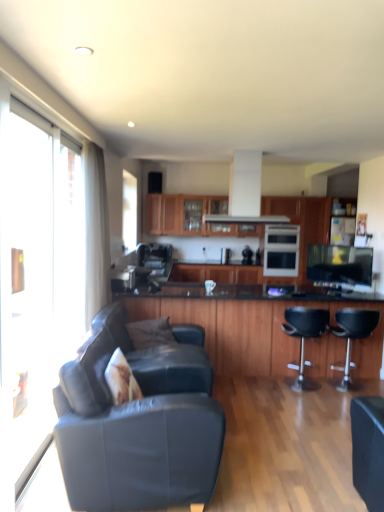
The width and height of the screenshot is (384, 512). What are the coordinates of `black leather bar stool at center right, placed as the 2th chair when sorted from right to left` in the screenshot? It's located at (305, 338).

What is the approximate width of transparent glass window at left?

4.10 inches.

Describe the element at coordinates (95, 231) in the screenshot. I see `white sheer curtain at left` at that location.

Image resolution: width=384 pixels, height=512 pixels. I want to click on transparent glass screen door at left, so click(35, 281).

You are a GUI agent. You are given a task and a screenshot of the screen. Output one action in this format:
    pyautogui.click(x=<x>, y=<y>)
    Task: Click on the black leather bar stool at center right, placed as the 2th chair when sorted from right to left
    The width and height of the screenshot is (384, 512).
    Given the screenshot: What is the action you would take?
    pyautogui.click(x=305, y=338)

Considering the positions of objects wooden cabinet at center, acting as the first cabinetry starting from the back, and black leather bar stool at center right, acting as the first chair starting from the left, in the image provided, who is more to the right, wooden cabinet at center, acting as the first cabinetry starting from the back, or black leather bar stool at center right, acting as the first chair starting from the left,?

black leather bar stool at center right, acting as the first chair starting from the left, is more to the right.

From a real-world perspective, is wooden cabinet at center, which appears as the second cabinetry when viewed from the front, over black leather bar stool at center right, placed as the 2th chair when sorted from right to left?

Yes, from a real-world perspective, wooden cabinet at center, which appears as the second cabinetry when viewed from the front, is above black leather bar stool at center right, placed as the 2th chair when sorted from right to left.

Would you say wooden cabinet at center, which appears as the second cabinetry when viewed from the front, is outside black leather bar stool at center right, placed as the 2th chair when sorted from right to left?

Indeed, wooden cabinet at center, which appears as the second cabinetry when viewed from the front, is completely outside black leather bar stool at center right, placed as the 2th chair when sorted from right to left.

Is wooden cabinet at center, which appears as the second cabinetry when viewed from the front, taller than black leather bar stool at center right, acting as the first chair starting from the left?

No.

From a real-world perspective, is black leather bar stool at center right, placed as the 2th chair when sorted from right to left, positioned over black leather bar stool at center, arranged as the second chair when viewed from the left, based on gravity?

Indeed, from a real-world perspective, black leather bar stool at center right, placed as the 2th chair when sorted from right to left, stands above black leather bar stool at center, arranged as the second chair when viewed from the left.

How many degrees apart are the facing directions of black leather bar stool at center right, acting as the first chair starting from the left, and black leather bar stool at center, arranged as the second chair when viewed from the left?

1.42 degrees.

Between point (302, 352) and point (346, 339), which one is positioned in front?

The point (346, 339) is in front.

From a real-world perspective, is transparent glass screen door at left positioned under wooden cabinet at center, which appears as the second cabinetry when viewed from the front, based on gravity?

Actually, transparent glass screen door at left is physically above wooden cabinet at center, which appears as the second cabinetry when viewed from the front, in the real world.

What's the angular difference between transparent glass screen door at left and wooden cabinet at center, which appears as the second cabinetry when viewed from the front,'s facing directions?

The facing directions of transparent glass screen door at left and wooden cabinet at center, which appears as the second cabinetry when viewed from the front, are 90.6 degrees apart.

From the image's perspective, is transparent glass screen door at left located above or below wooden cabinet at center, acting as the first cabinetry starting from the back?

transparent glass screen door at left is above wooden cabinet at center, acting as the first cabinetry starting from the back.

Consider the image. Which object is more forward, transparent glass screen door at left or wooden cabinet at center, which appears as the second cabinetry when viewed from the front?

transparent glass screen door at left.

Where is `oven above the leather couch at lower left (from the image's perspective)`? oven above the leather couch at lower left (from the image's perspective) is located at coordinates click(281, 250).

Is point (278, 258) farther from viewer compared to point (174, 352)?

Yes, point (278, 258) is behind point (174, 352).

In terms of height, does white glossy oven at center look taller or shorter compared to leather couch at lower left?

Considering their sizes, white glossy oven at center has less height than leather couch at lower left.

Could you measure the distance between leather couch at lower left and black leather bar stool at center right, acting as the first chair starting from the left?

The distance of leather couch at lower left from black leather bar stool at center right, acting as the first chair starting from the left, is 1.89 meters.

Find the location of a particular element. chair that is the 1st one when counting backward from the leather couch at lower left is located at coordinates (305, 338).

Is point (159, 464) closer to camera compared to point (293, 383)?

Yes, it is in front of point (293, 383).

From a real-world perspective, which object stands above the other?

leather couch at lower left is physically above.

Can you confirm if white glossy oven at center is wider than transparent glass window at left?

Yes, white glossy oven at center is wider than transparent glass window at left.

Is there a large distance between white glossy oven at center and transparent glass window at left?

That's right, there is a large distance between white glossy oven at center and transparent glass window at left.

I want to click on oven above the transparent glass window at left (from the image's perspective), so click(281, 250).

Which is more to the right, white glossy oven at center or transparent glass window at left?

white glossy oven at center is more to the right.

Is gray fabric pillow at center, which is the first pillow in back-to-front order, thinner than black leather bar stool at center right, placed as the 2th chair when sorted from right to left?

Yes, gray fabric pillow at center, which is the first pillow in back-to-front order, is thinner than black leather bar stool at center right, placed as the 2th chair when sorted from right to left.

Is black leather bar stool at center right, placed as the 2th chair when sorted from right to left, at the back of gray fabric pillow at center, which is the first pillow in back-to-front order?

gray fabric pillow at center, which is the first pillow in back-to-front order, is not turned away from black leather bar stool at center right, placed as the 2th chair when sorted from right to left.

Is black leather bar stool at center right, placed as the 2th chair when sorted from right to left, located within gray fabric pillow at center, which is the second pillow in front-to-back order?

No, black leather bar stool at center right, placed as the 2th chair when sorted from right to left, is not surrounded by gray fabric pillow at center, which is the second pillow in front-to-back order.

This screenshot has height=512, width=384. I want to click on the 2nd cabinetry behind the black leather bar stool at center right, placed as the 2th chair when sorted from right to left, so click(216, 273).

You are a GUI agent. You are given a task and a screenshot of the screen. Output one action in this format:
    pyautogui.click(x=<x>, y=<y>)
    Task: Click on the chair on the left of the black leather bar stool at center, arranged as the second chair when viewed from the left
    This screenshot has width=384, height=512.
    Given the screenshot: What is the action you would take?
    pyautogui.click(x=305, y=338)

Looking at the image, which one is located further to white sheer curtain at left, wooden cabinet at center, arranged as the second cabinetry when viewed from the back, or transparent glass screen door at left?

The object further to white sheer curtain at left is wooden cabinet at center, arranged as the second cabinetry when viewed from the back.

When comparing their distances from white textured pillow at lower left, placed as the first pillow when sorted from front to back, does black leather bar stool at center right, acting as the first chair starting from the left, or transparent glass window at left seem closer?

The object closer to white textured pillow at lower left, placed as the first pillow when sorted from front to back, is transparent glass window at left.

Estimate the real-world distances between objects in this image. Which object is further from black leather bar stool at center, positioned as the first chair in right-to-left order, leather couch at lower left or wooden cabinet at center, acting as the first cabinetry starting from the back?

leather couch at lower left lies further to black leather bar stool at center, positioned as the first chair in right-to-left order, than the other object.

From the image, which object appears to be nearer to wooden cabinet at center, acting as the first cabinetry starting from the back, black leather bar stool at center right, acting as the first chair starting from the left, or black leather bar stool at center, positioned as the first chair in right-to-left order?

Based on the image, black leather bar stool at center right, acting as the first chair starting from the left, appears to be nearer to wooden cabinet at center, acting as the first cabinetry starting from the back.

Estimate the real-world distances between objects in this image. Which object is closer to wooden cabinet at center, acting as the first cabinetry starting from the back, black leather bar stool at center, arranged as the second chair when viewed from the left, or leather couch at lower left?

black leather bar stool at center, arranged as the second chair when viewed from the left, is positioned closer to the anchor wooden cabinet at center, acting as the first cabinetry starting from the back.

Which object lies further to the anchor point wooden cabinet at center, acting as the first cabinetry starting from the back, transparent glass screen door at left or white glossy oven at center?

The object further to wooden cabinet at center, acting as the first cabinetry starting from the back, is transparent glass screen door at left.

Which object lies nearer to the anchor point white glossy oven at center, white sheer curtain at left or wooden cabinet at center, which appears as the second cabinetry when viewed from the front?

wooden cabinet at center, which appears as the second cabinetry when viewed from the front, is closer to white glossy oven at center.

Which object lies nearer to the anchor point white glossy oven at center, black leather bar stool at center right, acting as the first chair starting from the left, or leather couch at lower left?

black leather bar stool at center right, acting as the first chair starting from the left.

Locate an element on the screen. This screenshot has width=384, height=512. pillow situated between white textured pillow at lower left, placed as the first pillow when sorted from front to back, and black leather bar stool at center, arranged as the second chair when viewed from the left, from left to right is located at coordinates (150, 333).

Where is `couch situated between white textured pillow at lower left, the 2th pillow when ordered from back to front, and black leather bar stool at center right, acting as the first chair starting from the left, from left to right`? The image size is (384, 512). couch situated between white textured pillow at lower left, the 2th pillow when ordered from back to front, and black leather bar stool at center right, acting as the first chair starting from the left, from left to right is located at coordinates (161, 356).

The image size is (384, 512). I want to click on couch between white sheer curtain at left and white textured pillow at lower left, the 2th pillow when ordered from back to front, in the up-down direction, so click(161, 356).

Where is `studio couch located between transparent glass screen door at left and white sheer curtain at left in the depth direction`? The height and width of the screenshot is (512, 384). studio couch located between transparent glass screen door at left and white sheer curtain at left in the depth direction is located at coordinates (137, 424).